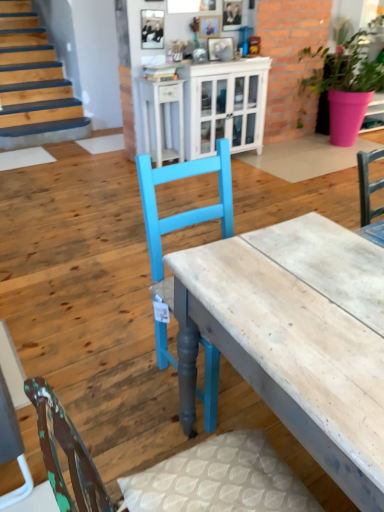
Question: From their relative heights in the image, would you say wooden desk at center is taller or shorter than white glossy cabinet at upper center?

Choices:
 (A) tall
 (B) short

Answer: (B)

Question: Considering their positions, is wooden desk at center located in front of or behind white glossy cabinet at upper center?

Choices:
 (A) behind
 (B) front

Answer: (B)

Question: Considering the real-world distances, which object is closest to the pink matte pot at upper right?

Choices:
 (A) white glossy cabinet at upper center
 (B) white glossy cabinet at upper center
 (C) wooden desk at center

Answer: (A)

Question: Estimate the real-world distances between objects in this image. Which object is farther from the wooden desk at center?

Choices:
 (A) pink matte pot at upper right
 (B) white glossy cabinet at upper center
 (C) white glossy cabinet at upper center

Answer: (A)